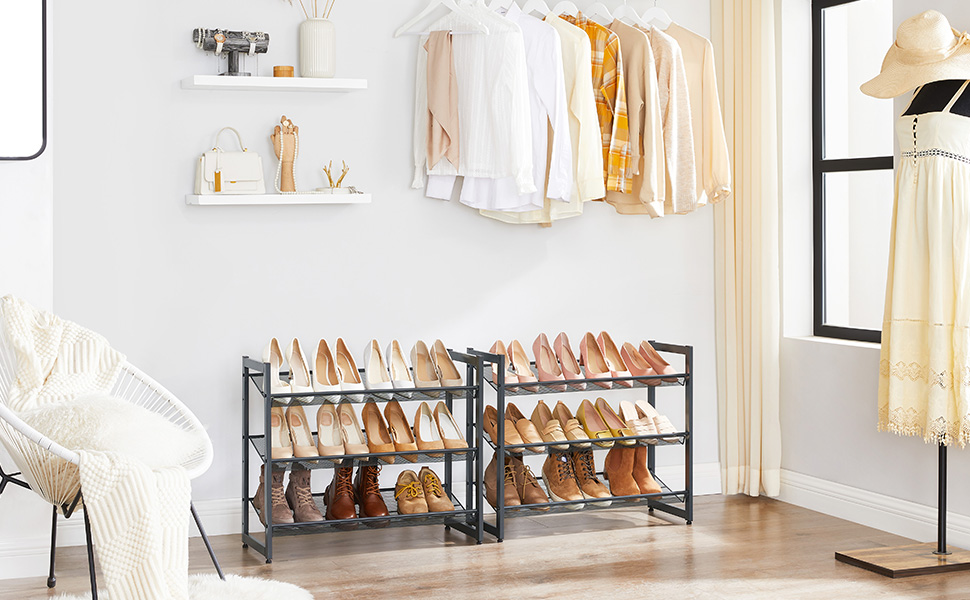
This screenshot has height=600, width=970. In order to click on shelf in this screenshot , I will do `click(353, 519)`, `click(359, 461)`, `click(364, 394)`, `click(559, 381)`, `click(557, 446)`, `click(559, 499)`, `click(288, 191)`, `click(287, 80)`.